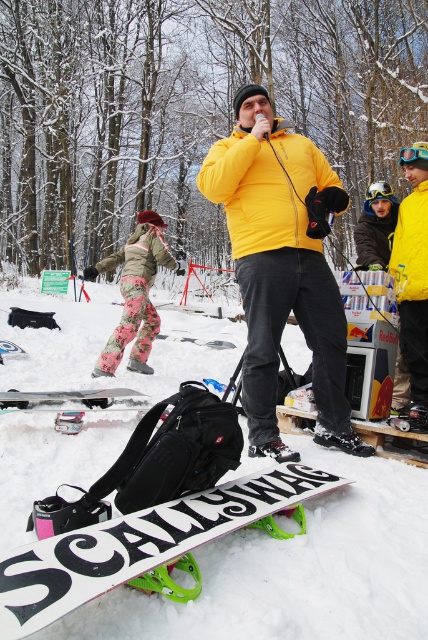
You are a photographer trying to capture a photo of the white matte snowboard at lower center without the yellow matte jacket at center blocking the view. Based on their positions, is this possible?

The yellow matte jacket at center is located above the white matte snowboard at lower center, so it is blocking the snowboard. To capture the snowboard without the jacket in the frame, you would need to adjust your angle or move the jacket temporarily.